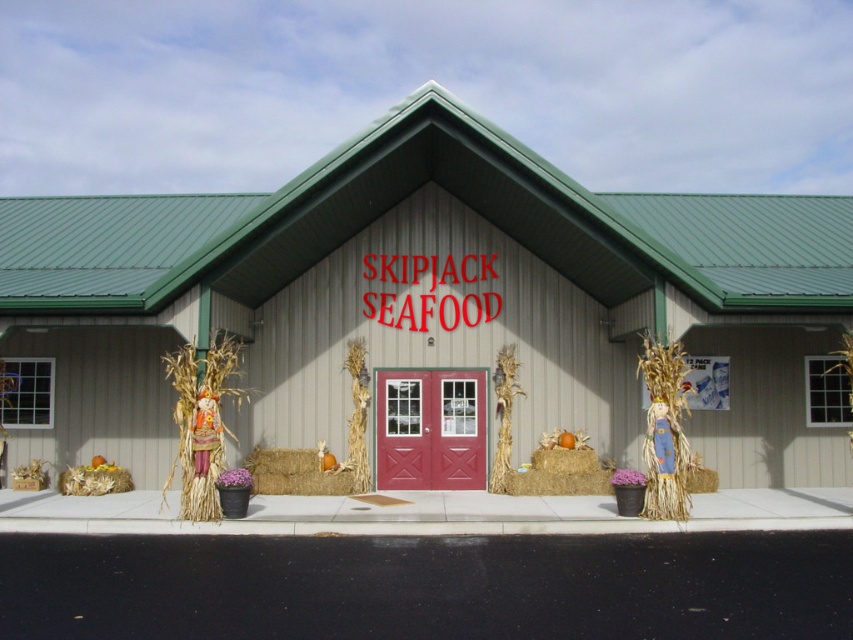
Question: Can you confirm if bleached straw bale at center is positioned below yellow straw bale at lower left?

Choices:
 (A) yes
 (B) no

Answer: (B)

Question: From the image, what is the correct spatial relationship of bleached straw bale at center in relation to braided straw hay at lower right?

Choices:
 (A) left
 (B) right

Answer: (A)

Question: Which object is closer to the camera taking this photo?

Choices:
 (A) yellow straw bale at lower left
 (B) braided straw hay at lower right
 (C) gray siding at center
 (D) bleached straw bale at center

Answer: (C)

Question: Which object is farther from the camera taking this photo?

Choices:
 (A) braided straw hay at lower right
 (B) gray siding at center
 (C) bleached straw bale at center
 (D) yellow straw bale at lower left

Answer: (D)

Question: Which point is closer to the camera taking this photo?

Choices:
 (A) (117, 483)
 (B) (279, 412)
 (C) (247, 456)
 (D) (711, 474)

Answer: (D)

Question: In this image, where is yellow straw bale at lower left located relative to braided straw hay at lower right?

Choices:
 (A) right
 (B) left

Answer: (B)